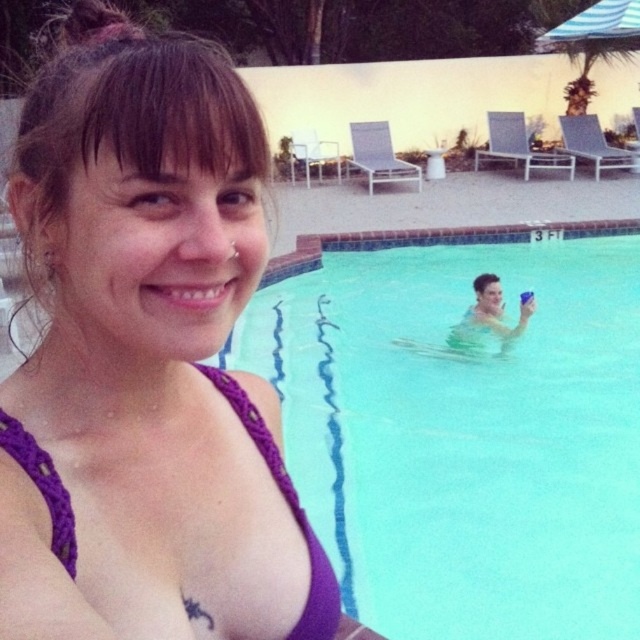
You are a swimmer who wants to know which bikini top is higher up in the image. You see the purple fabric bikini top at upper left and the purple macrame bikini top at center. Which one is positioned higher?

The purple fabric bikini top at upper left is taller than the purple macrame bikini top at center, so the purple fabric bikini top at upper left is positioned higher.

You are a photographer standing at the edge of the pool. You want to take a photo of the purple macrame bikini top at center and the clear blue water at center. Which object should you focus on first if you want to capture both in the same frame without moving the camera?

The purple macrame bikini top at center is on the left side of the clear blue water at center. Since they are positioned next to each other, you can focus on either one first as they are both within the same frame.